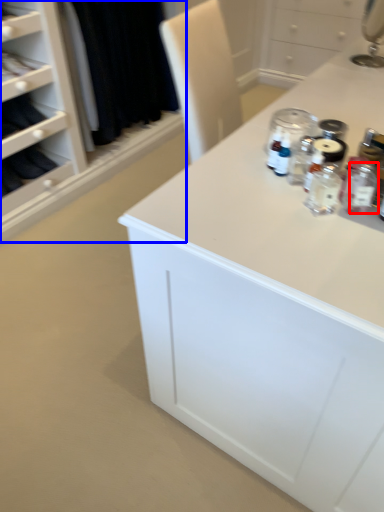
Question: Which point is further to the camera, bottle (highlighted by a red box) or closet (highlighted by a blue box)?

Choices:
 (A) bottle
 (B) closet

Answer: (B)